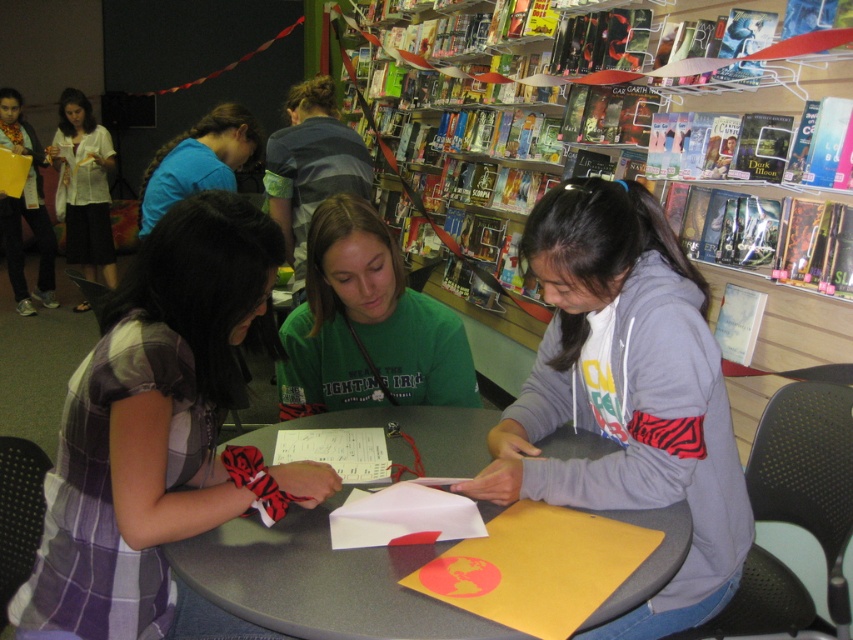
Between smooth gray table at center and green matte shirt at center, which one appears on the left side from the viewer's perspective?

green matte shirt at center is more to the left.

Is smooth gray table at center shorter than green matte shirt at center?

Yes.

Find the location of `smooth gray table at center`. smooth gray table at center is located at coordinates (320, 580).

Between point (100, 349) and point (79, 148), which one is positioned behind?

The point (79, 148) is more distant.

You are a GUI agent. You are given a task and a screenshot of the screen. Output one action in this format:
    pyautogui.click(x=<x>, y=<y>)
    Task: Click on the plaid fabric shirt at center
    
    Given the screenshot: What is the action you would take?
    pyautogui.click(x=160, y=435)

You are a GUI agent. You are given a task and a screenshot of the screen. Output one action in this format:
    pyautogui.click(x=<x>, y=<y>)
    Task: Click on the plaid fabric shirt at center
    
    Given the screenshot: What is the action you would take?
    pyautogui.click(x=160, y=435)

Is point (550, 280) farther from viewer compared to point (99, 221)?

That is False.

What do you see at coordinates (625, 392) in the screenshot? The image size is (853, 640). I see `gray fleece hoodie at center` at bounding box center [625, 392].

Is point (721, 596) in front of point (67, 97)?

Yes, point (721, 596) is in front of point (67, 97).

The width and height of the screenshot is (853, 640). What are the coordinates of `gray fleece hoodie at center` in the screenshot? It's located at 625,392.